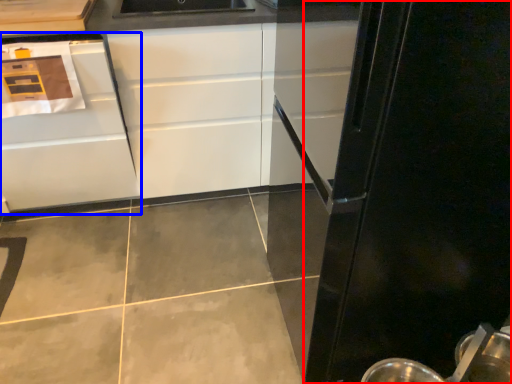
Question: Which of the following is the farthest to the observer, glass door (highlighted by a red box) or cabinetry (highlighted by a blue box)?

Choices:
 (A) glass door
 (B) cabinetry

Answer: (B)